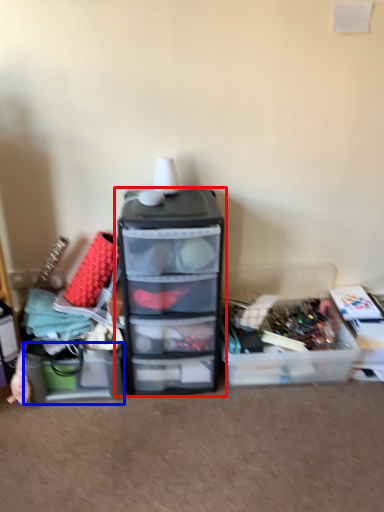
Question: Among these objects, which one is farthest to the camera, furniture (highlighted by a red box) or storage box (highlighted by a blue box)?

Choices:
 (A) furniture
 (B) storage box

Answer: (B)